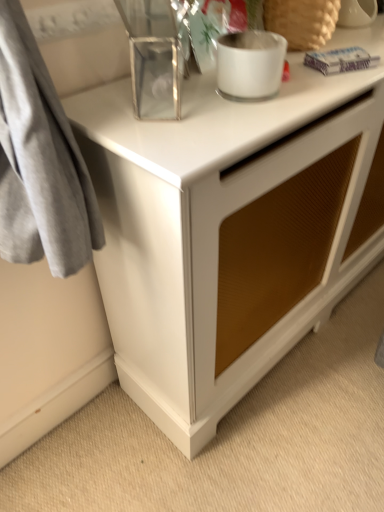
Where is `empty space that is to the right of frosted glass candle at upper center, which ranks as the second appliance in right-to-left order`? empty space that is to the right of frosted glass candle at upper center, which ranks as the second appliance in right-to-left order is located at coordinates (316, 87).